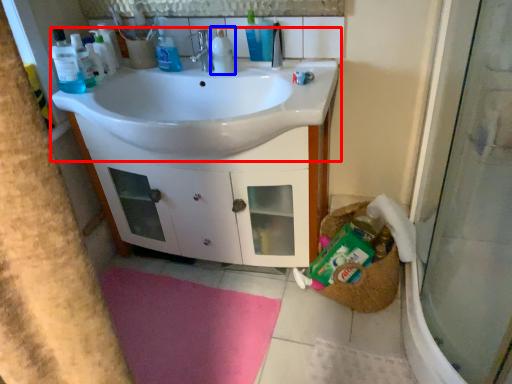
Question: Which of the following is the closest to the observer, sink (highlighted by a red box) or cleaning product (highlighted by a blue box)?

Choices:
 (A) sink
 (B) cleaning product

Answer: (A)